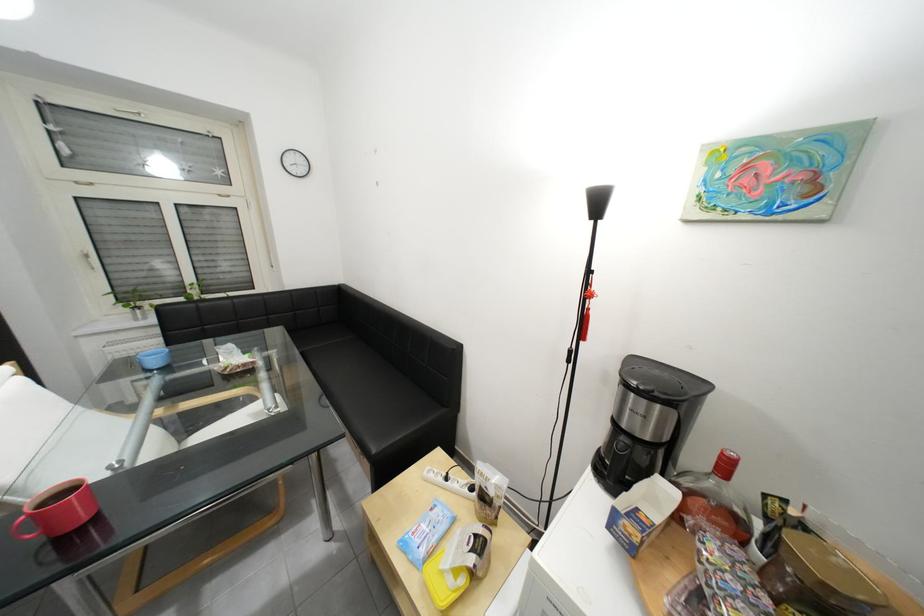
This screenshot has height=616, width=924. I want to click on gold jar lid, so point(830,573).